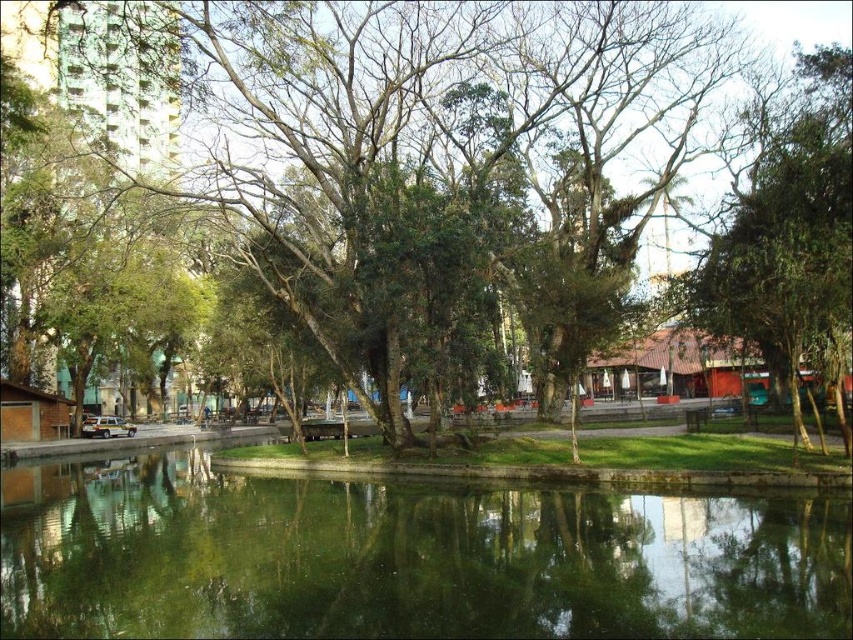
You are a park visitor wanting to take a photo of both the green leafy tree at right and the green leafy tree at center. Which tree should you stand closer to in order to capture both in a single frame?

You should stand closer to the green leafy tree at right because it has a smaller width than the green leafy tree at center, allowing both to fit within the camera frame more easily.

You are standing in the park and want to walk from point A to point B. Point A is at coordinates point (805, 316) and point B is at coordinates point (276, 136). Which point is closer to you when you start walking?

Point (805, 316) is closer to the viewer than point (276, 136), so you will start at the closer point and walk towards the farther one.

You are standing in the park and want to take a photo of both the green reflective water at center and the green leafy tree at right. Which object should you focus on first if you want to capture both in one frame without moving your camera?

The green reflective water at center is shorter than the green leafy tree at right. To capture both in one frame, focus on the green leafy tree at right first since it is taller and adjust the camera angle to include the shorter green reflective water at center.